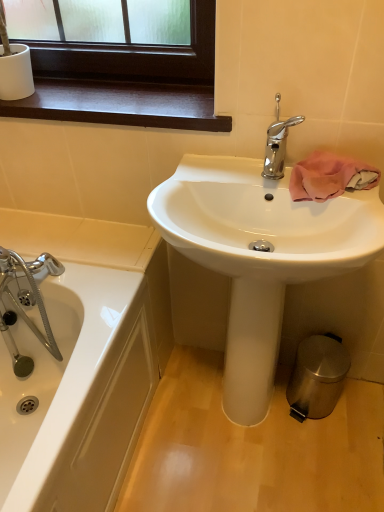
At what (x,y) coordinates should I click in order to perform the action: click on vacant point to the left of polished stainless steel trash can at lower right. Please return your answer as a coordinate pair (x, y). Image resolution: width=384 pixels, height=512 pixels. Looking at the image, I should click on (268, 416).